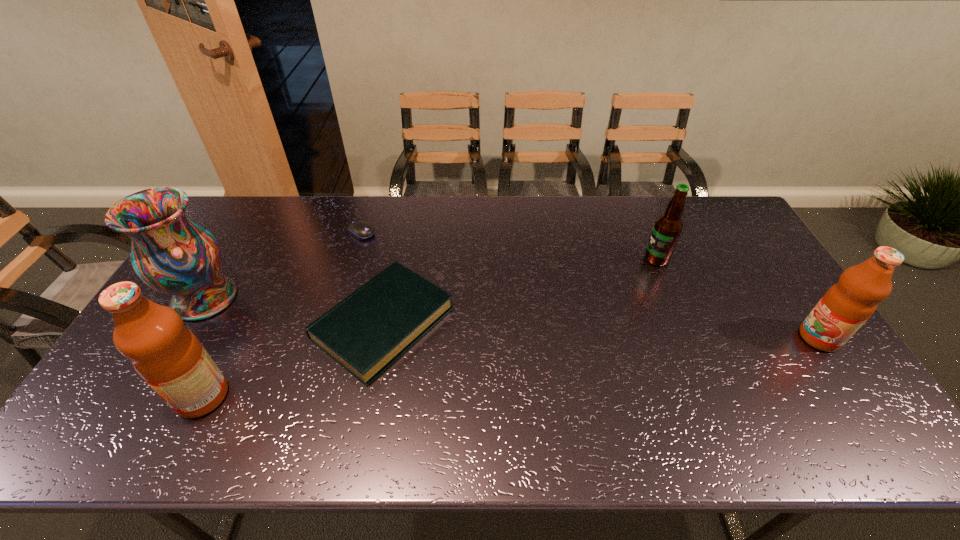
The image size is (960, 540). I want to click on vacant position for inserting another fruit_juice evenly, so click(x=528, y=366).